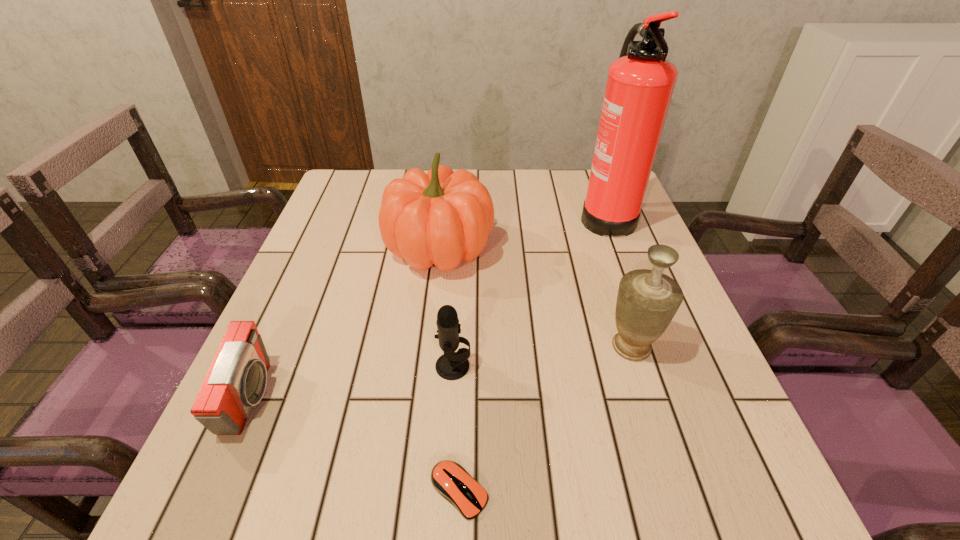
The width and height of the screenshot is (960, 540). I want to click on the tallest object, so click(x=640, y=83).

Identify the location of pumpkin. (443, 217).

This screenshot has width=960, height=540. In order to click on urn in this screenshot , I will do `click(647, 300)`.

Locate an element on the screen. Image resolution: width=960 pixels, height=540 pixels. the fourth tallest object is located at coordinates (452, 365).

Image resolution: width=960 pixels, height=540 pixels. In order to click on camera in this screenshot , I will do `click(236, 381)`.

Where is `the fifth tallest object`? The width and height of the screenshot is (960, 540). the fifth tallest object is located at coordinates (236, 381).

Find the location of a particular element. computer mouse is located at coordinates (449, 479).

Where is `the shortest object`? This screenshot has width=960, height=540. the shortest object is located at coordinates (449, 479).

Image resolution: width=960 pixels, height=540 pixels. In order to click on free space located at the nozzle of the fire extinguisher in this screenshot , I will do `click(532, 214)`.

At what (x,y) coordinates should I click in order to perform the action: click on free space located at the nozzle of the fire extinguisher. Please return your answer as a coordinate pair (x, y). This screenshot has height=540, width=960. Looking at the image, I should click on (488, 214).